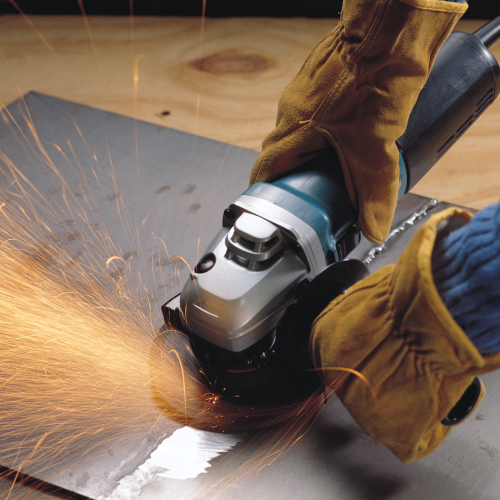
Where is `cord`? cord is located at coordinates (487, 38).